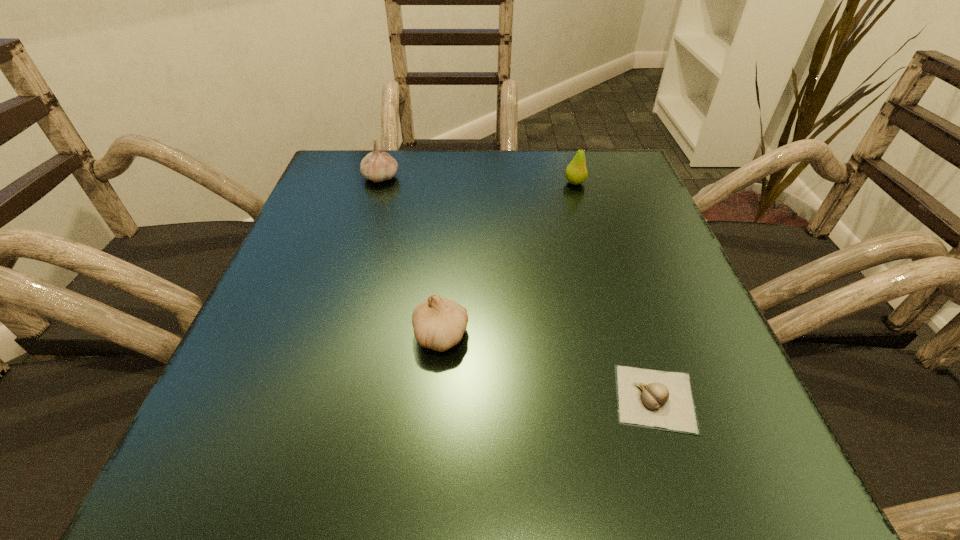
In the image, there is a desktop. At what (x,y) coordinates should I click in order to perform the action: click on vacant region at the far edge. Please return your answer as a coordinate pair (x, y). The image size is (960, 540). Looking at the image, I should click on (394, 181).

The width and height of the screenshot is (960, 540). What are the coordinates of `free space at the near edge of the desktop` in the screenshot? It's located at (339, 484).

In the image, there is a desktop. Identify the location of blank space at the left edge. (253, 398).

You are a GUI agent. You are given a task and a screenshot of the screen. Output one action in this format:
    pyautogui.click(x=<x>, y=<y>)
    Task: Click on the free space at the right edge of the desktop
    The height and width of the screenshot is (540, 960).
    Given the screenshot: What is the action you would take?
    pyautogui.click(x=583, y=235)

At what (x,y) coordinates should I click in order to perform the action: click on blank space at the far left corner of the desktop. Please return your answer as a coordinate pair (x, y). The image size is (960, 540). Looking at the image, I should click on (336, 158).

Locate an element on the screen. vacant space at the far right corner of the desktop is located at coordinates (634, 164).

You are a GUI agent. You are given a task and a screenshot of the screen. Output one action in this format:
    pyautogui.click(x=<x>, y=<y>)
    Task: Click on the vacant space that is in between the tallest garlic and the pear
    The height and width of the screenshot is (540, 960).
    Given the screenshot: What is the action you would take?
    pyautogui.click(x=478, y=180)

Find the location of a particular element. unoccupied position between the leftmost garlic and the second shortest garlic is located at coordinates (411, 256).

Where is `unoccupied area between the farthest garlic and the second shortest garlic`? This screenshot has width=960, height=540. unoccupied area between the farthest garlic and the second shortest garlic is located at coordinates 411,256.

Where is `vacant area that lies between the pear and the leftmost object`? The height and width of the screenshot is (540, 960). vacant area that lies between the pear and the leftmost object is located at coordinates (478, 180).